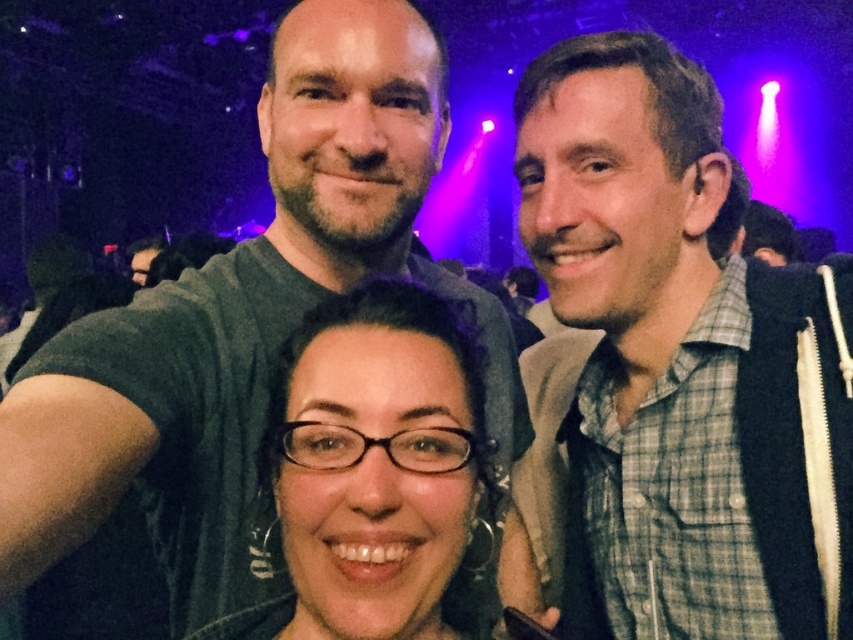
Consider the image. You are at a party and want to take a photo with your friends. You notice the green plaid shirt at center and the matte black glasses at center in the frame. Which object takes up more horizontal space in the photo?

The green plaid shirt at center might be wider than matte black glasses at center, so it likely takes up more horizontal space in the photo.

You are at a party and want to take a photo of the green plaid shirt at center. Where should you position yourself to capture it in the frame?

The green plaid shirt at center is located at point [672,371], so you should position yourself directly in front of that coordinate to ensure it is centered in your photo.